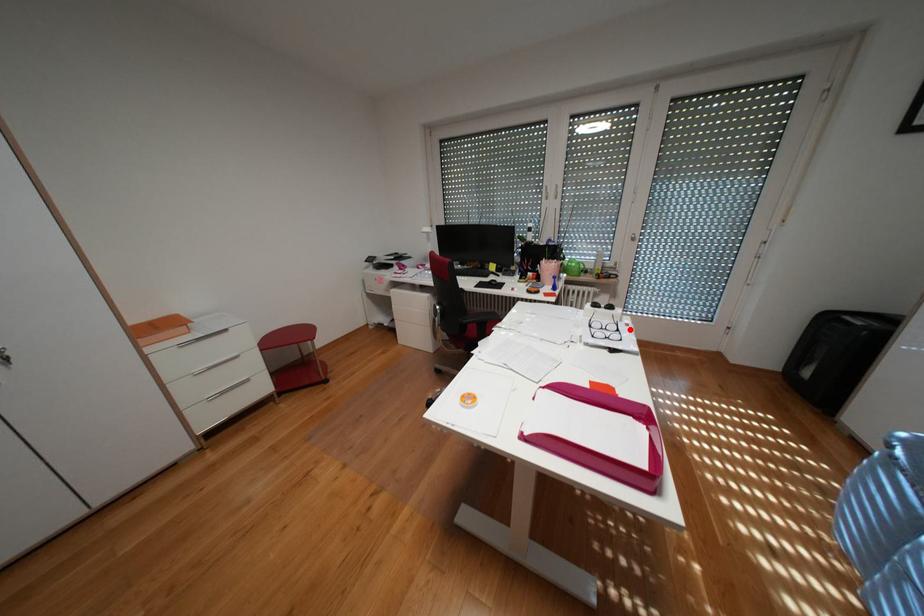
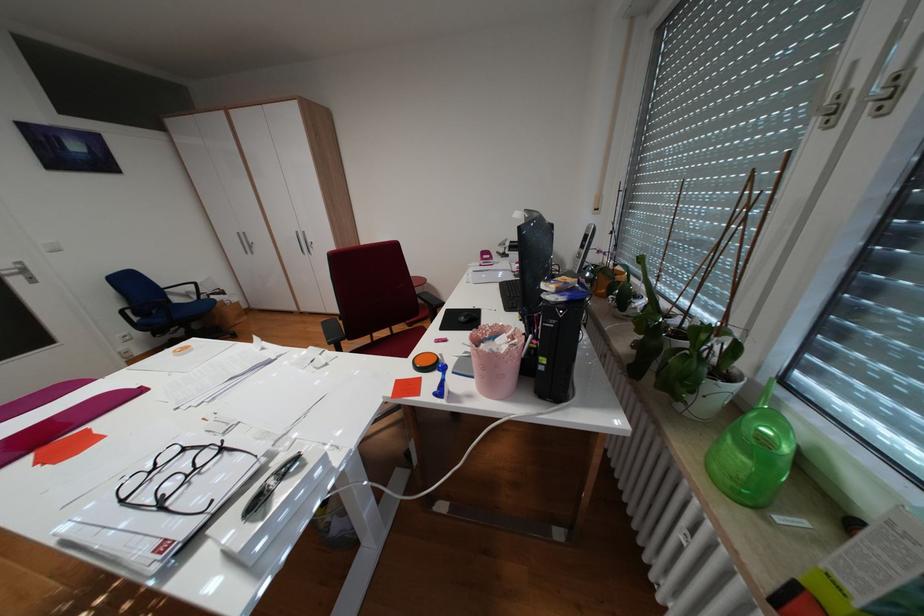
Locate, in the second image, the point that corresponds to the highlighted location in the first image.

(173, 505)